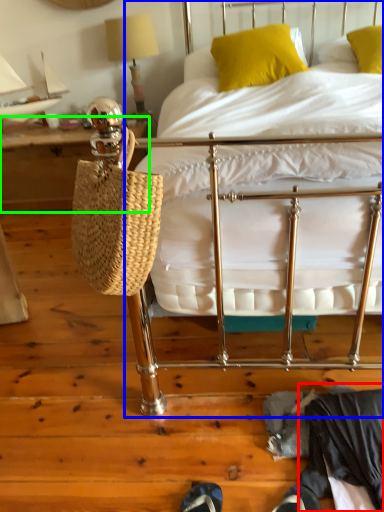
Question: Which is farther away from clothing (highlighted by a red box)? bed (highlighted by a blue box) or table (highlighted by a green box)?

Choices:
 (A) bed
 (B) table

Answer: (B)